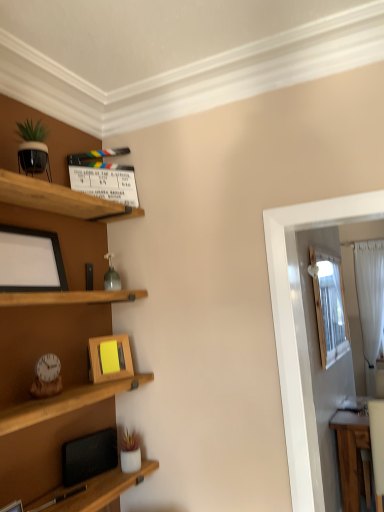
Question: Is matte black picture frame at left, the 2th picture frame in the right-to-left sequence, facing away from white sheer curtain at right?

Choices:
 (A) no
 (B) yes

Answer: (A)

Question: Does matte black picture frame at left, marked as the 2th picture frame in a bottom-to-top arrangement, have a lesser height compared to white sheer curtain at right?

Choices:
 (A) yes
 (B) no

Answer: (A)

Question: Does matte black picture frame at left, marked as the 2th picture frame in a bottom-to-top arrangement, come behind white sheer curtain at right?

Choices:
 (A) no
 (B) yes

Answer: (A)

Question: Is the depth of matte black picture frame at left, marked as the 2th picture frame in a bottom-to-top arrangement, less than that of white sheer curtain at right?

Choices:
 (A) no
 (B) yes

Answer: (B)

Question: Does matte black picture frame at left, marked as the 2th picture frame in a bottom-to-top arrangement, contain white sheer curtain at right?

Choices:
 (A) yes
 (B) no

Answer: (B)

Question: In terms of size, does white sheer curtain at right appear bigger or smaller than wooden picture frame at center, which is the 2th picture frame in front-to-back order?

Choices:
 (A) big
 (B) small

Answer: (A)

Question: From the image's perspective, is white sheer curtain at right above or below wooden picture frame at center, which is the second picture frame in left-to-right order?

Choices:
 (A) above
 (B) below

Answer: (B)

Question: Considering their positions, is white sheer curtain at right located in front of or behind wooden picture frame at center, which ranks as the 2th picture frame in top-to-bottom order?

Choices:
 (A) behind
 (B) front

Answer: (A)

Question: From a real-world perspective, is white sheer curtain at right positioned above or below wooden picture frame at center, which is the second picture frame in left-to-right order?

Choices:
 (A) above
 (B) below

Answer: (B)

Question: From the image's perspective, relative to white sheer curtain at right, is wooden picture frame at center, which is the 2th picture frame in front-to-back order, above or below?

Choices:
 (A) above
 (B) below

Answer: (A)

Question: Considering the positions of point (91, 352) and point (380, 289), is point (91, 352) closer or farther from the camera than point (380, 289)?

Choices:
 (A) farther
 (B) closer

Answer: (B)

Question: Relative to white sheer curtain at right, is wooden picture frame at center, which is the 2th picture frame in front-to-back order, in front or behind?

Choices:
 (A) front
 (B) behind

Answer: (A)

Question: Is wooden picture frame at center, positioned as the 1th picture frame in right-to-left order, taller or shorter than white sheer curtain at right?

Choices:
 (A) short
 (B) tall

Answer: (A)

Question: Based on their sizes in the image, would you say matte black picture frame at left, which appears as the 1th picture frame when viewed from the top, is bigger or smaller than white sheer curtain at right?

Choices:
 (A) big
 (B) small

Answer: (B)

Question: Is matte black picture frame at left, marked as the 2th picture frame in a bottom-to-top arrangement, taller or shorter than white sheer curtain at right?

Choices:
 (A) short
 (B) tall

Answer: (A)